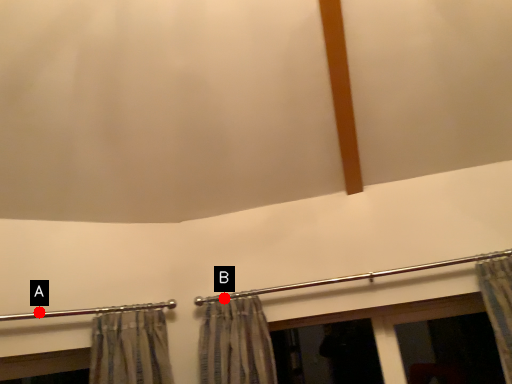
Question: Two points are circled on the image, labeled by A and B beside each circle. Which point appears closest to the camera in this image?

Choices:
 (A) A is closer
 (B) B is closer

Answer: (A)